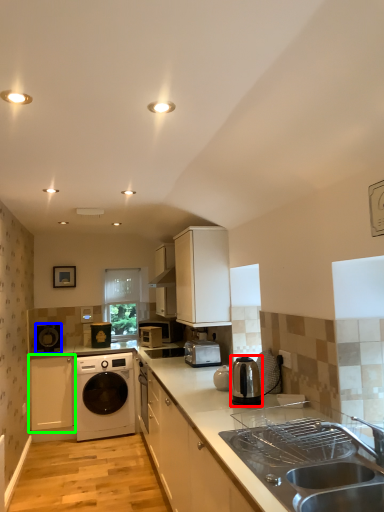
Question: Which object is the closest to the home appliance (highlighted by a red box)? Choose among these: home appliance (highlighted by a blue box) or cabinetry (highlighted by a green box).

Choices:
 (A) home appliance
 (B) cabinetry

Answer: (B)